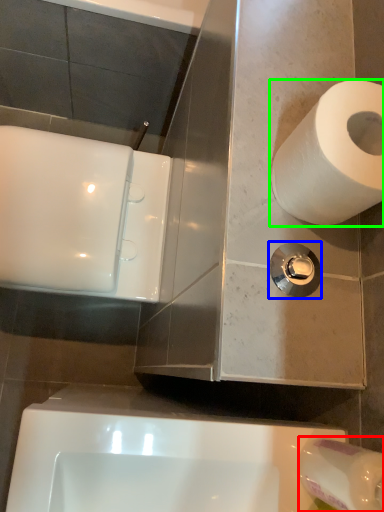
Question: Estimate the real-world distances between objects in this image. Which object is closer to toilet paper (highlighted by a red box), plumbing fixture (highlighted by a blue box) or toilet paper (highlighted by a green box)?

Choices:
 (A) plumbing fixture
 (B) toilet paper

Answer: (A)